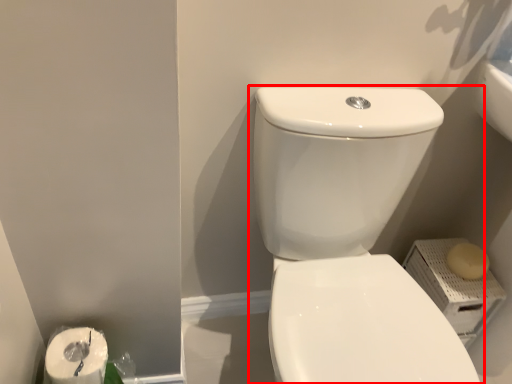
Question: From the image's perspective, what is the correct spatial relationship of toilet (annotated by the red box) in relation to soap?

Choices:
 (A) above
 (B) below

Answer: (B)